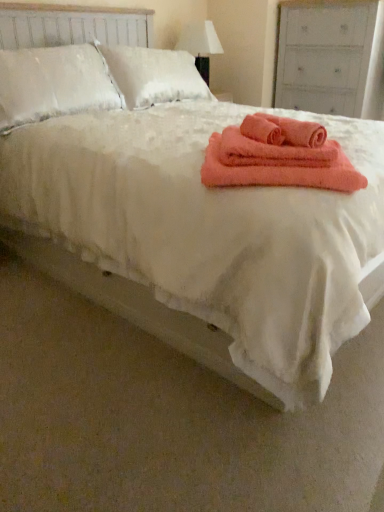
Question: Is coral soft towel at center in front of or behind white fabric lampshade at upper center in the image?

Choices:
 (A) front
 (B) behind

Answer: (A)

Question: Looking at their shapes, would you say coral soft towel at center is wider or thinner than white fabric lampshade at upper center?

Choices:
 (A) wide
 (B) thin

Answer: (A)

Question: Estimate the real-world distances between objects in this image. Which object is farther from the coral soft towel at center, positioned as the 3th bath towel in right-to-left order?

Choices:
 (A) white painted wood dresser at upper right
 (B) coral soft towel at center
 (C) coral fuzzy bath towel at center, which appears as the second bath towel when viewed from the left
 (D) white fabric lampshade at upper center
 (E) coral fuzzy bath towel at center, the 3th bath towel when ordered from left to right

Answer: (A)

Question: Estimate the real-world distances between objects in this image. Which object is farther from the white painted wood dresser at upper right?

Choices:
 (A) white fabric lampshade at upper center
 (B) coral soft towel at center, positioned as the 3th bath towel in right-to-left order
 (C) coral fuzzy bath towel at center, acting as the 1th bath towel starting from the right
 (D) coral fuzzy bath towel at center, which appears as the second bath towel when viewed from the left
 (E) coral soft towel at center

Answer: (D)